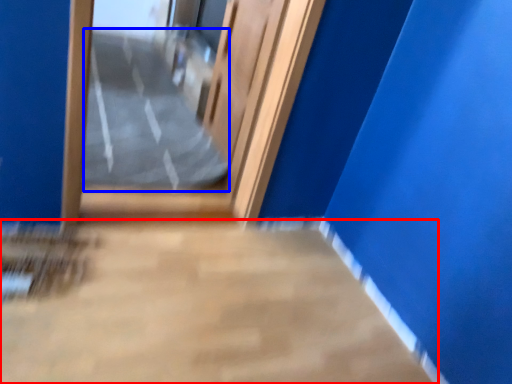
Question: Which of the following is the farthest to the observer, concrete (highlighted by a red box) or path (highlighted by a blue box)?

Choices:
 (A) concrete
 (B) path

Answer: (B)